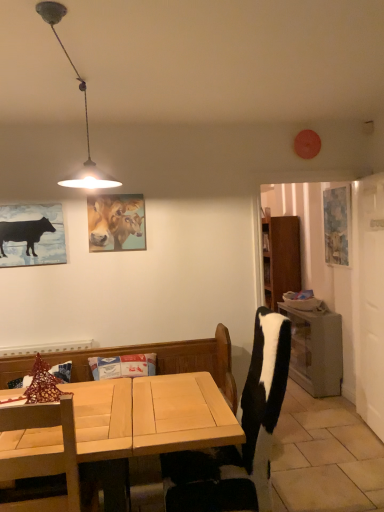
Where is `vacant area on top of metallic pendant light at upper left (from a real-world perspective)`? This screenshot has height=512, width=384. vacant area on top of metallic pendant light at upper left (from a real-world perspective) is located at coordinates (75, 62).